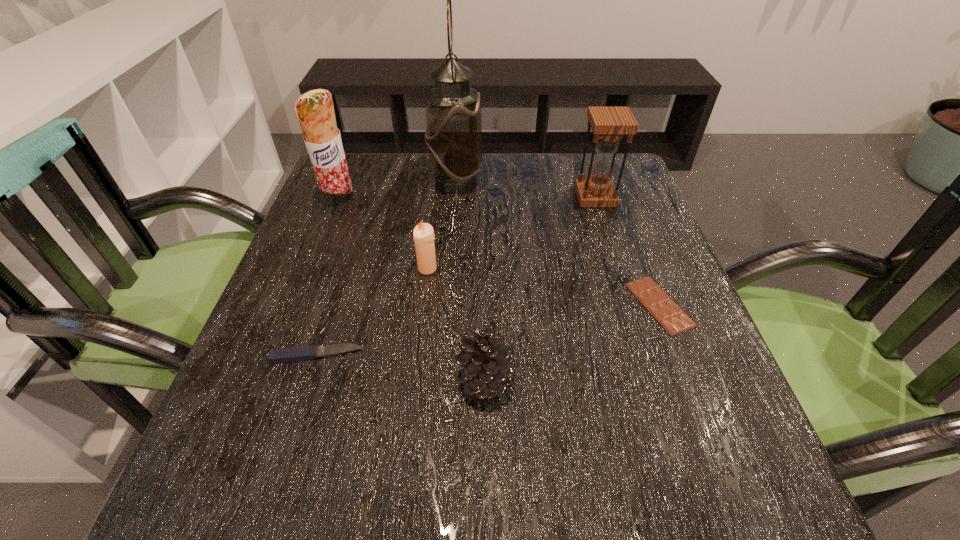
What are the coordinates of `the tallest object` in the screenshot? It's located at (454, 137).

This screenshot has width=960, height=540. I want to click on the sixth shortest object, so click(x=315, y=111).

You are a GUI agent. You are given a task and a screenshot of the screen. Output one action in this format:
    pyautogui.click(x=<x>, y=<y>)
    Task: Click on the hourglass
    This screenshot has width=960, height=540.
    Given the screenshot: What is the action you would take?
    pyautogui.click(x=609, y=124)

Image resolution: width=960 pixels, height=540 pixels. Find the location of `candle`. candle is located at coordinates (423, 235).

Find the location of a particular element. The height and width of the screenshot is (540, 960). pinecone is located at coordinates (487, 363).

I want to click on the sixth tallest object, so click(x=293, y=354).

Find the location of `the shortest object`. the shortest object is located at coordinates (670, 316).

At what (x,y) coordinates should I click in order to perform the action: click on chocolate bar. Please return your answer as a coordinate pair (x, y). Image resolution: width=960 pixels, height=540 pixels. Looking at the image, I should click on (670, 316).

This screenshot has width=960, height=540. In order to click on free point located 0.140m on the left of the tallest object in this screenshot , I will do `click(373, 181)`.

Find the location of a particular element. This screenshot has height=540, width=960. vacant area located 0.070m on the back of the burrito is located at coordinates (348, 173).